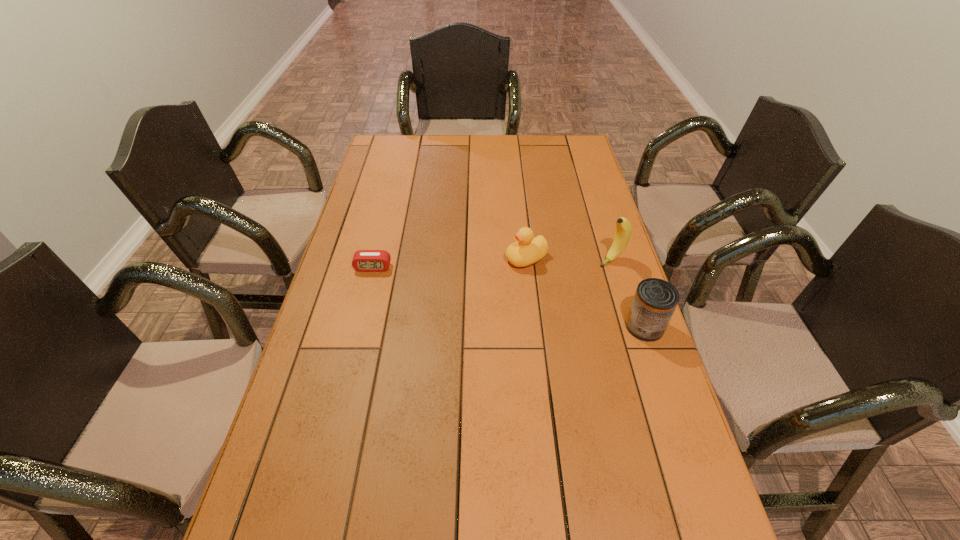
In order to click on vacant space on the desktop that is between the alarm clock and the can and is positioned from the stem of the tallest object in this screenshot , I will do `click(539, 303)`.

Identify the location of free space on the desktop that is between the alarm clock and the nearest object and is positioned on the face of the duck. This screenshot has width=960, height=540. (463, 287).